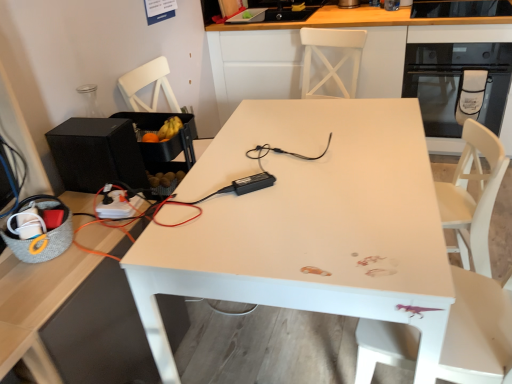
What do you see at coordinates (330, 27) in the screenshot? I see `white glossy cabinet at upper center` at bounding box center [330, 27].

In order to face white glossy cabinet at upper center, should I rotate leftwards or rightwards?

A 14.775 degree turn to the right will do.

The width and height of the screenshot is (512, 384). Identify the location of white matte table at center. (308, 224).

Where is `black glass oven at upper right`? The image size is (512, 384). black glass oven at upper right is located at coordinates (460, 33).

You are a GUI agent. You are given a task and a screenshot of the screen. Output one action in this format:
    pyautogui.click(x=<x>, y=<y>)
    Task: Click on the white glossy cabinet at upper center
    This screenshot has height=384, width=512.
    Given the screenshot: What is the action you would take?
    pyautogui.click(x=330, y=27)

Who is more distant, white matte table at center or white glossy cabinet at upper center?

white glossy cabinet at upper center.

Is white matte table at center to the right of white glossy cabinet at upper center from the viewer's perspective?

In fact, white matte table at center is to the left of white glossy cabinet at upper center.

In the scene shown: Is the surface of white matte table at center in direct contact with white glossy cabinet at upper center?

No, white matte table at center is not in contact with white glossy cabinet at upper center.

Does black matte speaker at left appear on the right side of white matte table at center?

In fact, black matte speaker at left is to the left of white matte table at center.

Is black matte speaker at left oriented towards white matte table at center?

Yes, black matte speaker at left is oriented towards white matte table at center.

Who is taller, black matte speaker at left or white matte table at center?

white matte table at center.

From the image's perspective, does black matte speaker at left appear lower than white matte table at center?

No, from the image's perspective, black matte speaker at left is not beneath white matte table at center.

Does white matte table at center appear on the right side of black matte speaker at left?

Yes, white matte table at center is to the right of black matte speaker at left.

From the picture: Is white matte table at center facing away from black matte speaker at left?

Yes, black matte speaker at left is at the back of white matte table at center.

Is point (279, 214) farther from viewer compared to point (94, 151)?

No, it is in front of (94, 151).

I want to click on table in front of the black matte speaker at left, so (x=308, y=224).

Does black matte speaker at left appear on the left side of black glass oven at upper right?

Yes, black matte speaker at left is to the left of black glass oven at upper right.

Considering the sizes of black matte speaker at left and black glass oven at upper right in the image, is black matte speaker at left wider or thinner than black glass oven at upper right?

In the image, black matte speaker at left appears to be more narrow than black glass oven at upper right.

From the image's perspective, which is below, black matte speaker at left or black glass oven at upper right?

black matte speaker at left, from the image's perspective.

Image resolution: width=512 pixels, height=384 pixels. Find the location of `appliance below the black glass oven at upper right (from the image's perspective)`. appliance below the black glass oven at upper right (from the image's perspective) is located at coordinates (97, 154).

From a real-world perspective, which is physically above, black matte speaker at left or white glossy cabinet at upper center?

In real-world perspective, black matte speaker at left is above.

Can you confirm if black matte speaker at left is taller than white glossy cabinet at upper center?

In fact, black matte speaker at left may be shorter than white glossy cabinet at upper center.

Measure the distance from black matte speaker at left to white glossy cabinet at upper center.

black matte speaker at left is 5.17 feet away from white glossy cabinet at upper center.

Is black matte speaker at left positioned with its back to white glossy cabinet at upper center?

No, black matte speaker at left's orientation is not away from white glossy cabinet at upper center.

Is point (422, 40) closer to viewer compared to point (308, 155)?

No, (422, 40) is behind (308, 155).

Is white glossy cabinet at upper center aimed at white matte table at center?

Yes.

Are white glossy cabinet at upper center and white matte table at center beside each other?

No, white glossy cabinet at upper center is not touching white matte table at center.

From a real-world perspective, between white glossy cabinet at upper center and black matte speaker at left, who is vertically higher?

In real-world perspective, black matte speaker at left is above.

Considering the sizes of white glossy cabinet at upper center and black matte speaker at left in the image, is white glossy cabinet at upper center taller or shorter than black matte speaker at left?

Clearly, white glossy cabinet at upper center is taller compared to black matte speaker at left.

Can you confirm if white glossy cabinet at upper center is wider than black matte speaker at left?

Correct, the width of white glossy cabinet at upper center exceeds that of black matte speaker at left.

Is black matte speaker at left at the back of white glossy cabinet at upper center?

No.

The image size is (512, 384). What are the coordinates of `cabinetry behind the white matte table at center` in the screenshot? It's located at (330, 27).

At what (x,y) coordinates should I click in order to perform the action: click on appliance above the white matte table at center (from a real-world perspective). Please return your answer as a coordinate pair (x, y). The image size is (512, 384). Looking at the image, I should click on [x=97, y=154].

From the image, which object appears to be farther from black matte speaker at left, white matte table at center or black glass oven at upper right?

black glass oven at upper right is positioned further to the anchor black matte speaker at left.

Estimate the real-world distances between objects in this image. Which object is closer to black glass oven at upper right, white matte table at center or black matte speaker at left?

The object closer to black glass oven at upper right is white matte table at center.

Estimate the real-world distances between objects in this image. Which object is closer to white glossy cabinet at upper center, white matte table at center or black glass oven at upper right?

black glass oven at upper right lies closer to white glossy cabinet at upper center than the other object.

Looking at the image, which one is located further to black matte speaker at left, black glass oven at upper right or white matte table at center?

The object further to black matte speaker at left is black glass oven at upper right.

Considering their positions, is black matte speaker at left positioned closer to black glass oven at upper right than white matte table at center?

white matte table at center is closer to black glass oven at upper right.

Estimate the real-world distances between objects in this image. Which object is further from black glass oven at upper right, black matte speaker at left or white glossy cabinet at upper center?

Among the two, black matte speaker at left is located further to black glass oven at upper right.

When comparing their distances from black matte speaker at left, does white glossy cabinet at upper center or white matte table at center seem further?

white glossy cabinet at upper center lies further to black matte speaker at left than the other object.

When comparing their distances from white matte table at center, does black glass oven at upper right or black matte speaker at left seem further?

The object further to white matte table at center is black glass oven at upper right.

Find the location of a particular element. Image resolution: width=512 pixels, height=384 pixels. table located between black matte speaker at left and white glossy cabinet at upper center in the left-right direction is located at coordinates (308, 224).

Where is `table located between black matte speaker at left and black glass oven at upper right in the left-right direction`? table located between black matte speaker at left and black glass oven at upper right in the left-right direction is located at coordinates (308, 224).

Where is `cabinetry between black matte speaker at left and black glass oven at upper right from left to right`? Image resolution: width=512 pixels, height=384 pixels. cabinetry between black matte speaker at left and black glass oven at upper right from left to right is located at coordinates (330, 27).

Image resolution: width=512 pixels, height=384 pixels. What are the coordinates of `cabinetry between white matte table at center and black glass oven at upper right along the z-axis` in the screenshot? It's located at (330, 27).